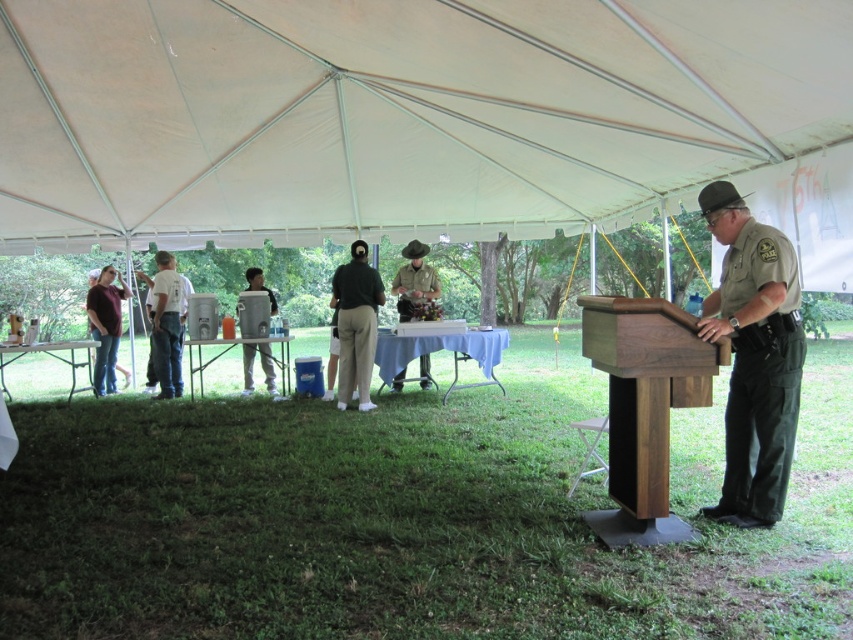
Looking at this image, which of these two, green uniform at right or brushed metal cooler at center, stands taller?

With more height is green uniform at right.

Is green uniform at right above brushed metal cooler at center?

Correct, green uniform at right is located above brushed metal cooler at center.

The width and height of the screenshot is (853, 640). I want to click on green uniform at right, so click(x=758, y=369).

Is point (350, 332) more distant than point (175, 384)?

No, (350, 332) is closer to viewer.

Is green matte uniform at center to the left of white cotton shirt at left from the viewer's perspective?

No, green matte uniform at center is not to the left of white cotton shirt at left.

Does point (363, 385) come in front of point (172, 344)?

Yes.

The height and width of the screenshot is (640, 853). I want to click on green matte uniform at center, so (357, 324).

Between green matte uniform at center and dark green uniform at left, which one appears on the right side from the viewer's perspective?

green matte uniform at center is more to the right.

Can you confirm if green matte uniform at center is positioned below dark green uniform at left?

Incorrect, green matte uniform at center is not positioned below dark green uniform at left.

Is point (347, 310) positioned behind point (112, 348)?

No, (347, 310) is closer to viewer.

At what (x,y) coordinates should I click in order to perform the action: click on green matte uniform at center. Please return your answer as a coordinate pair (x, y). Looking at the image, I should click on [357, 324].